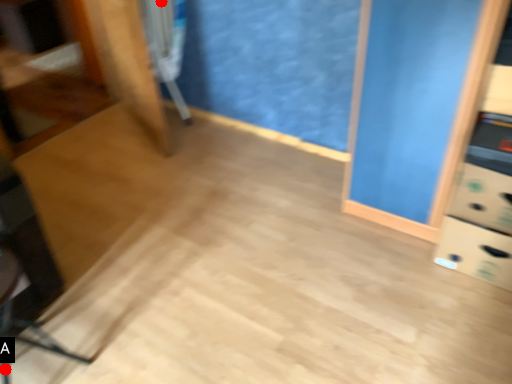
Question: Two points are circled on the image, labeled by A and B beside each circle. Among these points, which one is farthest from the camera?

Choices:
 (A) A is further
 (B) B is further

Answer: (B)